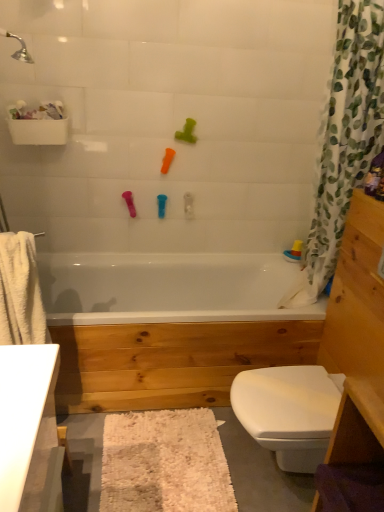
Question: Which direction should I rotate to look at orange rubber toy at upper center, the 3th toy positioned from the right, — up or down?

Choices:
 (A) down
 (B) up

Answer: (B)

Question: Does translucent plastic boat at upper right, which ranks as the first toy in right-to-left order, have a larger size compared to white shaggy bath mat at lower center?

Choices:
 (A) yes
 (B) no

Answer: (B)

Question: Is white shaggy bath mat at lower center at the back of translucent plastic boat at upper right, which appears as the 5th toy when viewed from the left?

Choices:
 (A) yes
 (B) no

Answer: (B)

Question: Does translucent plastic boat at upper right, which appears as the 5th toy when viewed from the left, have a lesser width compared to white shaggy bath mat at lower center?

Choices:
 (A) no
 (B) yes

Answer: (B)

Question: Can you confirm if translucent plastic boat at upper right, positioned as the fifth toy in top-to-bottom order, is smaller than white shaggy bath mat at lower center?

Choices:
 (A) yes
 (B) no

Answer: (A)

Question: Does translucent plastic boat at upper right, which appears as the 5th toy when viewed from the left, turn towards white shaggy bath mat at lower center?

Choices:
 (A) no
 (B) yes

Answer: (A)

Question: Considering the relative sizes of translucent plastic boat at upper right, positioned as the fifth toy in top-to-bottom order, and white shaggy bath mat at lower center in the image provided, is translucent plastic boat at upper right, positioned as the fifth toy in top-to-bottom order, taller than white shaggy bath mat at lower center?

Choices:
 (A) yes
 (B) no

Answer: (B)

Question: Considering the relative sizes of blue rubber toy at upper center, which is counted as the second toy, starting from the left, and white fabric shower curtain at right in the image provided, is blue rubber toy at upper center, which is counted as the second toy, starting from the left, thinner than white fabric shower curtain at right?

Choices:
 (A) yes
 (B) no

Answer: (A)

Question: Is blue rubber toy at upper center, which is counted as the second toy, starting from the left, touching white fabric shower curtain at right?

Choices:
 (A) no
 (B) yes

Answer: (A)

Question: From the image's perspective, is blue rubber toy at upper center, which is counted as the second toy, starting from the left, on white fabric shower curtain at right?

Choices:
 (A) no
 (B) yes

Answer: (A)

Question: Considering the relative sizes of blue rubber toy at upper center, which ranks as the 2th toy in bottom-to-top order, and white fabric shower curtain at right in the image provided, is blue rubber toy at upper center, which ranks as the 2th toy in bottom-to-top order, taller than white fabric shower curtain at right?

Choices:
 (A) no
 (B) yes

Answer: (A)

Question: From a real-world perspective, is blue rubber toy at upper center, the 4th toy from the top, under white fabric shower curtain at right?

Choices:
 (A) yes
 (B) no

Answer: (A)

Question: From the image's perspective, is blue rubber toy at upper center, which is counted as the second toy, starting from the left, under white fabric shower curtain at right?

Choices:
 (A) no
 (B) yes

Answer: (B)

Question: Does translucent plastic boat at upper right, which ranks as the first toy in right-to-left order, lie in front of light brown wood vanity at right?

Choices:
 (A) no
 (B) yes

Answer: (A)